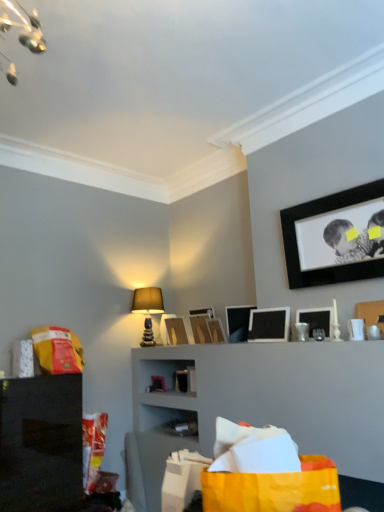
Question: Is matte black picture frame at upper right, which ranks as the 6th picture frame in back-to-front order, looking in the opposite direction of matte black picture frame at upper right, the seventh picture frame when ordered from back to front?

Choices:
 (A) yes
 (B) no

Answer: (B)

Question: Is matte black picture frame at upper right, which ranks as the 6th picture frame in back-to-front order, not near matte black picture frame at upper right, the seventh picture frame when ordered from back to front?

Choices:
 (A) no
 (B) yes

Answer: (A)

Question: Is the position of matte black picture frame at upper right, which ranks as the 6th picture frame in back-to-front order, more distant than that of matte black picture frame at upper right, the seventh picture frame when ordered from back to front?

Choices:
 (A) yes
 (B) no

Answer: (A)

Question: Is matte black picture frame at upper right, which is the 3th picture frame from front to back, beside matte black picture frame at upper right, the 2th picture frame viewed from the front?

Choices:
 (A) yes
 (B) no

Answer: (B)

Question: From the image's perspective, is matte black picture frame at upper right, which ranks as the 6th picture frame in back-to-front order, above matte black picture frame at upper right, the seventh picture frame when ordered from back to front?

Choices:
 (A) no
 (B) yes

Answer: (A)

Question: Is matte cardboard picture frame at center, placed as the seventh picture frame when sorted from front to back, spatially inside wooden picture frame at center, the 3th picture frame positioned from the back, or outside of it?

Choices:
 (A) outside
 (B) inside

Answer: (A)

Question: Is point (178, 332) positioned closer to the camera than point (203, 333)?

Choices:
 (A) closer
 (B) farther

Answer: (B)

Question: From a real-world perspective, is matte cardboard picture frame at center, placed as the seventh picture frame when sorted from front to back, above or below wooden picture frame at center, positioned as the 6th picture frame in front-to-back order?

Choices:
 (A) below
 (B) above

Answer: (A)

Question: In terms of width, does matte cardboard picture frame at center, which ranks as the second picture frame in back-to-front order, look wider or thinner when compared to wooden picture frame at center, the 3th picture frame positioned from the back?

Choices:
 (A) wide
 (B) thin

Answer: (A)

Question: Based on their positions, is matte black picture frame at upper right, the seventh picture frame when ordered from back to front, located to the left or right of matte cardboard picture frame at center, placed as the seventh picture frame when sorted from front to back?

Choices:
 (A) right
 (B) left

Answer: (A)

Question: Considering the positions of matte black picture frame at upper right, the 2th picture frame viewed from the front, and matte cardboard picture frame at center, placed as the seventh picture frame when sorted from front to back, in the image, is matte black picture frame at upper right, the 2th picture frame viewed from the front, taller or shorter than matte cardboard picture frame at center, placed as the seventh picture frame when sorted from front to back,?

Choices:
 (A) tall
 (B) short

Answer: (B)

Question: Is matte black picture frame at upper right, the 2th picture frame viewed from the front, wider or thinner than matte cardboard picture frame at center, which ranks as the second picture frame in back-to-front order?

Choices:
 (A) wide
 (B) thin

Answer: (B)

Question: From a real-world perspective, is matte black picture frame at upper right, the 2th picture frame viewed from the front, physically located above or below matte cardboard picture frame at center, which ranks as the second picture frame in back-to-front order?

Choices:
 (A) above
 (B) below

Answer: (B)

Question: Considering the positions of wooden picture frame at center, positioned as the 6th picture frame in front-to-back order, and black matte picture frame at upper right, which is counted as the first picture frame, starting from the front, in the image, is wooden picture frame at center, positioned as the 6th picture frame in front-to-back order, wider or thinner than black matte picture frame at upper right, which is counted as the first picture frame, starting from the front,?

Choices:
 (A) thin
 (B) wide

Answer: (B)

Question: Based on their sizes in the image, would you say wooden picture frame at center, the 3th picture frame positioned from the back, is bigger or smaller than black matte picture frame at upper right, which appears as the eighth picture frame when viewed from the back?

Choices:
 (A) big
 (B) small

Answer: (B)